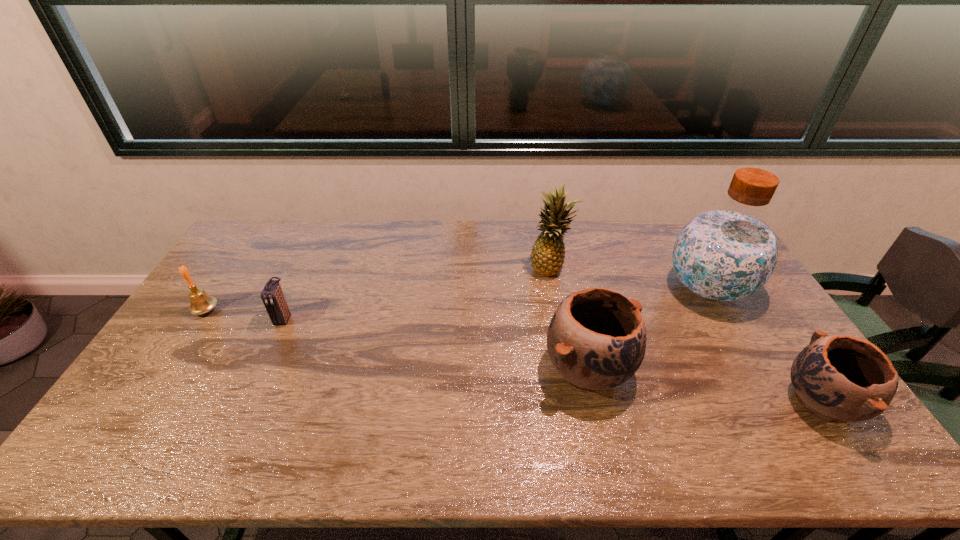
Point out which object is positioned as the third nearest to the leftmost object. Please provide its 2D coordinates. Your answer should be formatted as a tuple, i.e. [(x, y)], where the tuple contains the x and y coordinates of a point satisfying the conditions above.

[(596, 340)]

Where is `the closest object to the water jug`? Image resolution: width=960 pixels, height=540 pixels. the closest object to the water jug is located at coordinates (838, 378).

This screenshot has width=960, height=540. I want to click on free space that satisfies the following two spatial constraints: 1. on the front side of the right pottery; 2. on the left side of the tallest object, so click(x=774, y=402).

This screenshot has height=540, width=960. I want to click on vacant region that satisfies the following two spatial constraints: 1. on the front side of the fifth shortest object; 2. on the left side of the taller pottery, so click(569, 369).